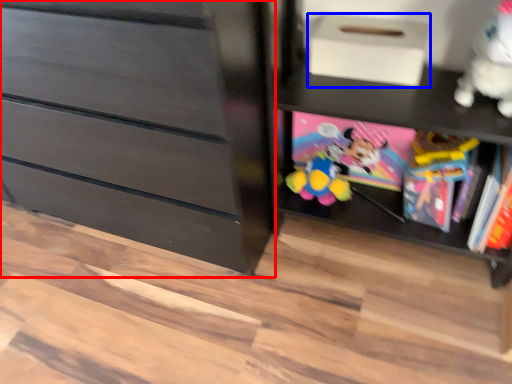
Question: Which object appears closest to the camera in this image, chest of drawers (highlighted by a red box) or shoe box (highlighted by a blue box)?

Choices:
 (A) chest of drawers
 (B) shoe box

Answer: (A)